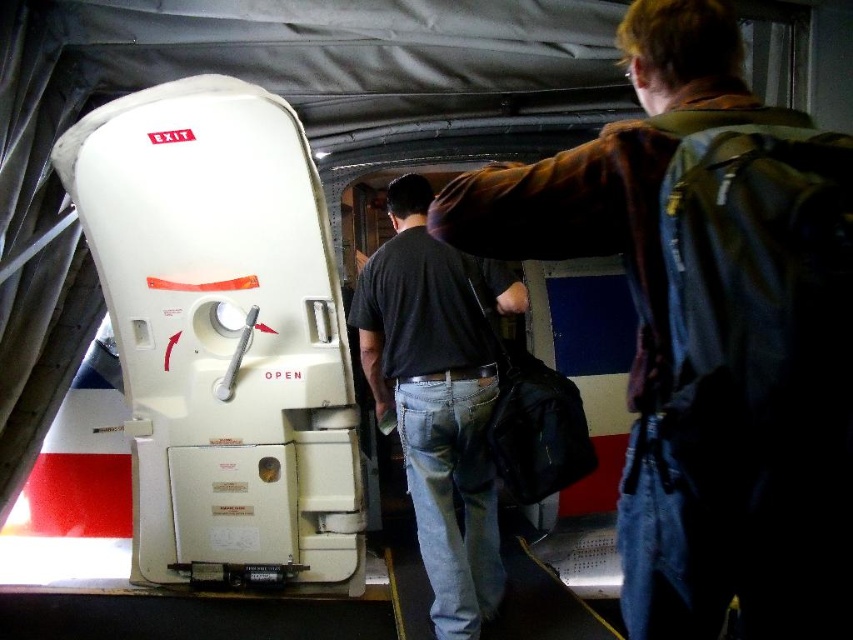
Question: Observing the image, what is the correct spatial positioning of denim jacket at upper right in reference to dark blue jeans at center?

Choices:
 (A) below
 (B) above

Answer: (B)

Question: Among these objects, which one is farthest from the camera?

Choices:
 (A) denim jacket at upper right
 (B) dark blue jeans at center

Answer: (B)

Question: Does denim jacket at upper right have a smaller size compared to dark blue jeans at center?

Choices:
 (A) no
 (B) yes

Answer: (B)

Question: Considering the relative positions of denim jacket at upper right and dark blue jeans at center in the image provided, where is denim jacket at upper right located with respect to dark blue jeans at center?

Choices:
 (A) above
 (B) below

Answer: (A)